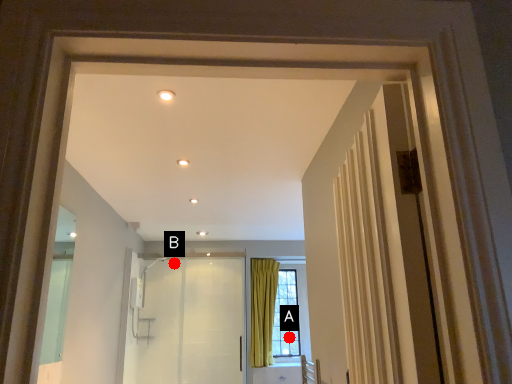
Question: Two points are circled on the image, labeled by A and B beside each circle. Which point appears farthest from the camera in this image?

Choices:
 (A) A is further
 (B) B is further

Answer: (A)